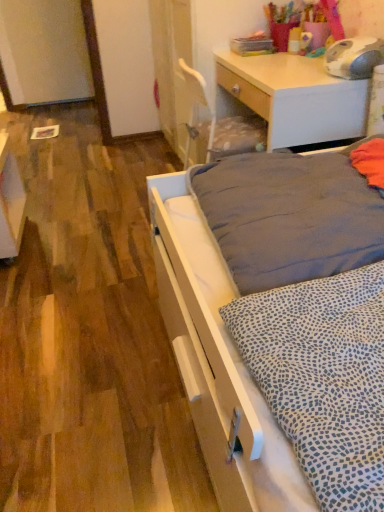
Question: Does light wood desk at upper right lie in front of white matte bed at lower right?

Choices:
 (A) yes
 (B) no

Answer: (B)

Question: Does light wood desk at upper right have a lesser width compared to white matte bed at lower right?

Choices:
 (A) yes
 (B) no

Answer: (A)

Question: From the image's perspective, is light wood desk at upper right under white matte bed at lower right?

Choices:
 (A) yes
 (B) no

Answer: (B)

Question: Does light wood desk at upper right touch white matte bed at lower right?

Choices:
 (A) yes
 (B) no

Answer: (B)

Question: Is light wood desk at upper right at the right side of white matte bed at lower right?

Choices:
 (A) yes
 (B) no

Answer: (A)

Question: Considering the relative positions of light wood desk at upper right and white matte bed at lower right in the image provided, is light wood desk at upper right behind white matte bed at lower right?

Choices:
 (A) yes
 (B) no

Answer: (A)

Question: From the image's perspective, does white matte bed at lower right appear higher than dark gray fabric mattress at center?

Choices:
 (A) yes
 (B) no

Answer: (B)

Question: Can you confirm if white matte bed at lower right is positioned to the right of dark gray fabric mattress at center?

Choices:
 (A) no
 (B) yes

Answer: (A)

Question: Is white matte bed at lower right next to dark gray fabric mattress at center?

Choices:
 (A) yes
 (B) no

Answer: (B)

Question: Considering the relative sizes of white matte bed at lower right and dark gray fabric mattress at center in the image provided, is white matte bed at lower right bigger than dark gray fabric mattress at center?

Choices:
 (A) yes
 (B) no

Answer: (A)

Question: From a real-world perspective, is white matte bed at lower right on dark gray fabric mattress at center?

Choices:
 (A) yes
 (B) no

Answer: (B)

Question: Could you tell me if white matte bed at lower right is turned towards dark gray fabric mattress at center?

Choices:
 (A) no
 (B) yes

Answer: (A)

Question: From a real-world perspective, is white glossy vanity at lower left under dark gray fabric mattress at center?

Choices:
 (A) yes
 (B) no

Answer: (A)